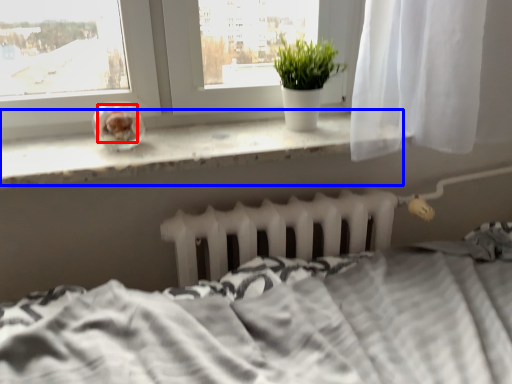
Question: Which object appears farthest to the camera in this image, food (highlighted by a red box) or window sill (highlighted by a blue box)?

Choices:
 (A) food
 (B) window sill

Answer: (A)